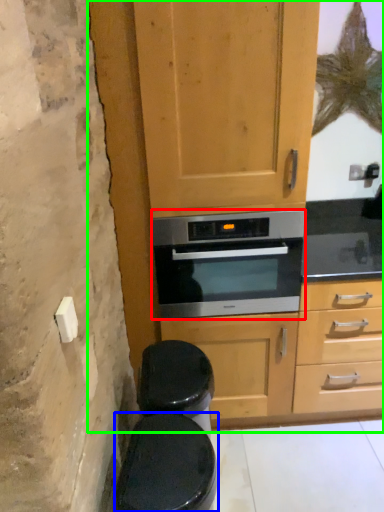
Question: Which object is positioned closest to oven (highlighted by a red box)? Select from toilet bowl (highlighted by a blue box) and dresser (highlighted by a green box).

Choices:
 (A) toilet bowl
 (B) dresser

Answer: (B)